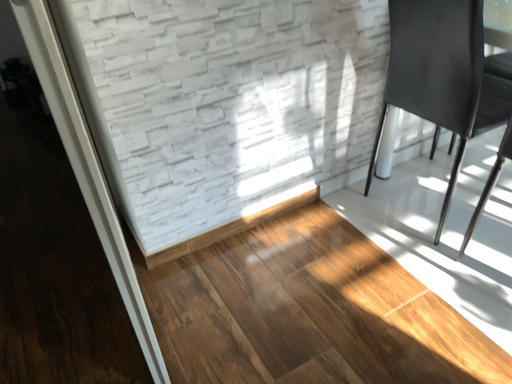
Locate an element on the screen. Image resolution: width=512 pixels, height=384 pixels. free spot in front of matte black chair at right is located at coordinates (425, 277).